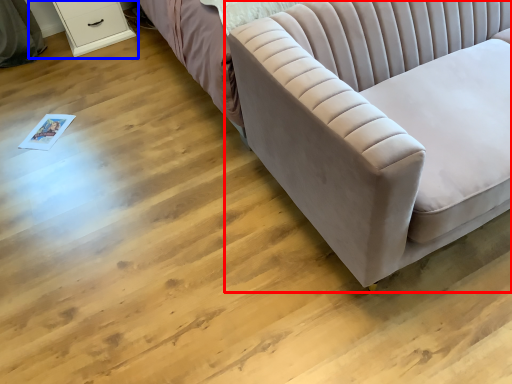
Question: Which point is closer to the camera, studio couch (highlighted by a red box) or dresser (highlighted by a blue box)?

Choices:
 (A) studio couch
 (B) dresser

Answer: (A)